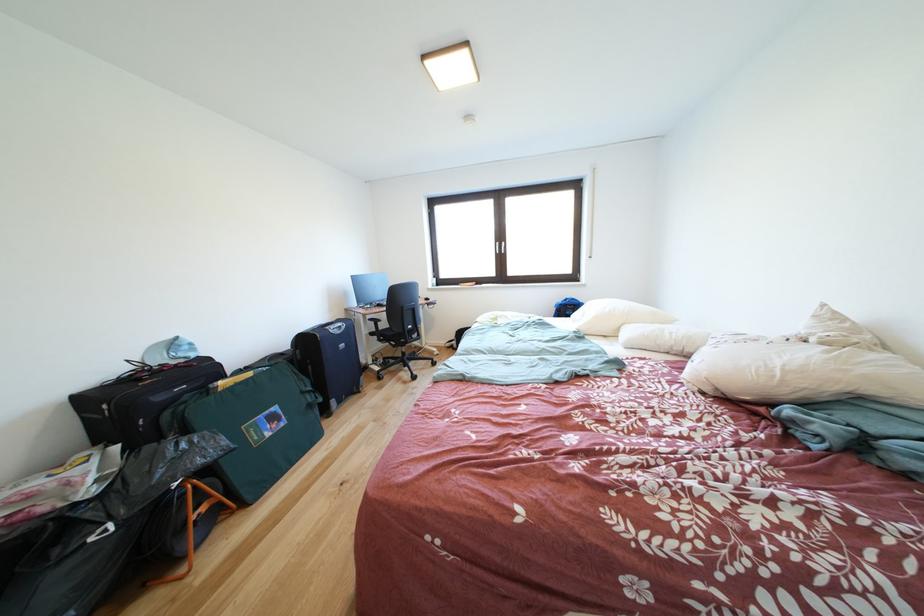
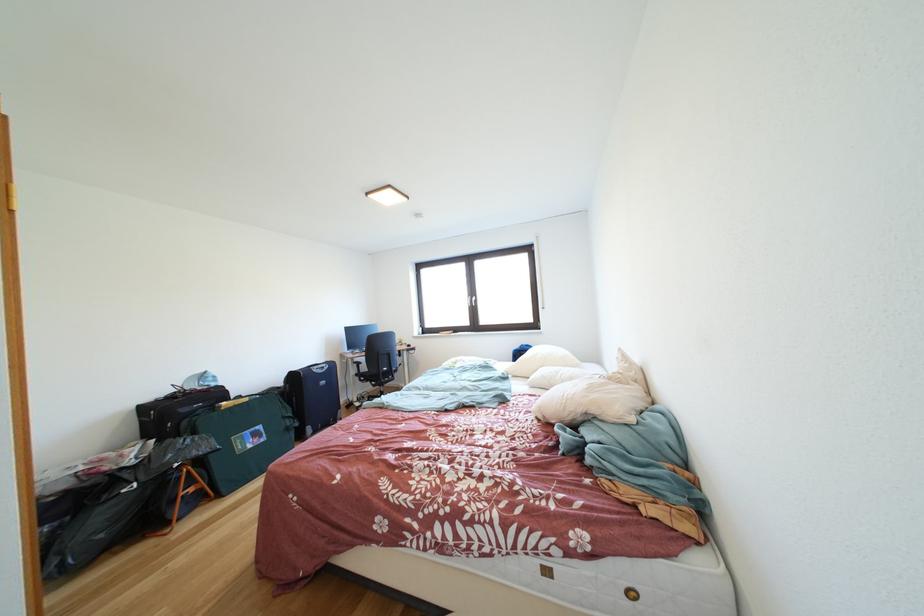
In the second image, find the point that corresponds to [403,351] in the first image.

(383, 391)